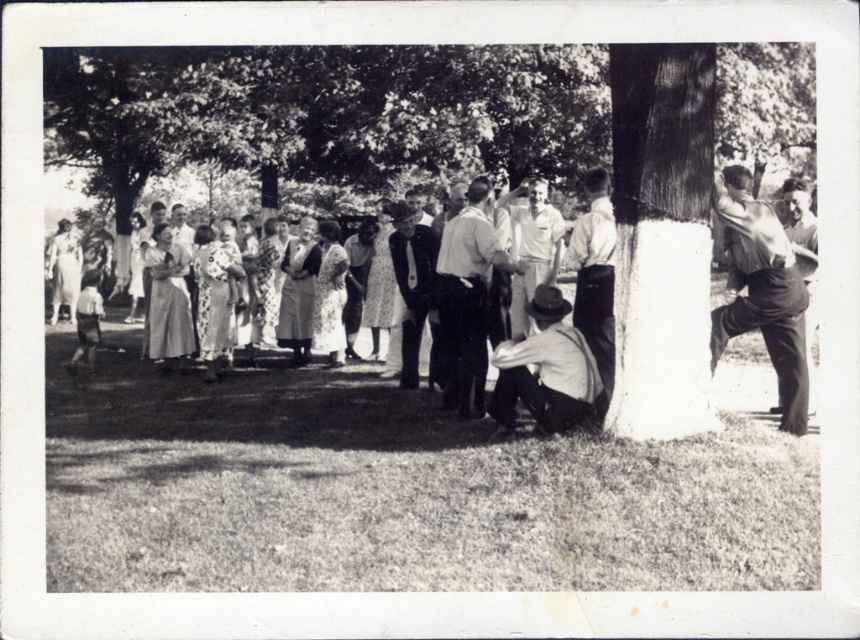
You are attending a formal event and need to determine which clothing item is shorter between the smooth black suit at center and the smooth brown shirt at right. Which one should you choose?

The smooth black suit at center is not as tall as the smooth brown shirt at right, so you should choose the smooth black suit at center as it is shorter.

You are attending a historical event and notice two people dressed in formal attire. The first is wearing a smooth black suit at center, and the second is wearing a smooth brown shirt at right. From your perspective, which person is standing to the left of the other?

The smooth black suit at center is positioned on the left side of smooth brown shirt at right, so the person in the smooth black suit at center is to the left of the person in the smooth brown shirt at right.